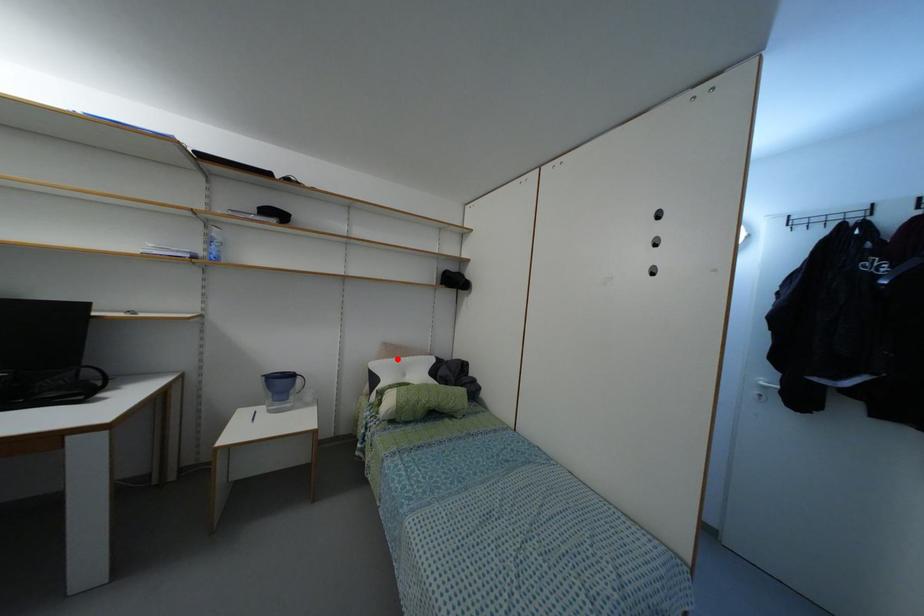
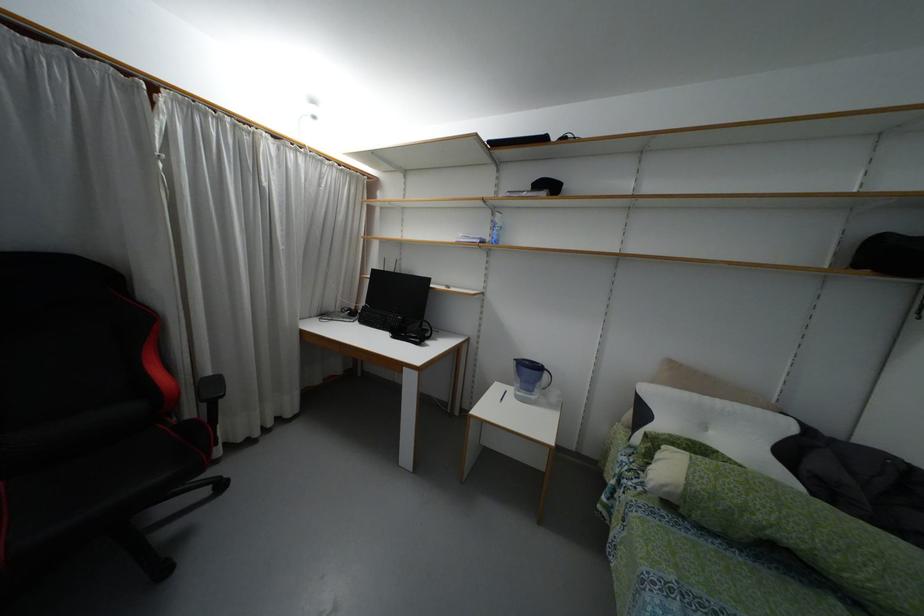
Where in the second image is the point corresponding to the highlighted location from the first image?

(695, 395)